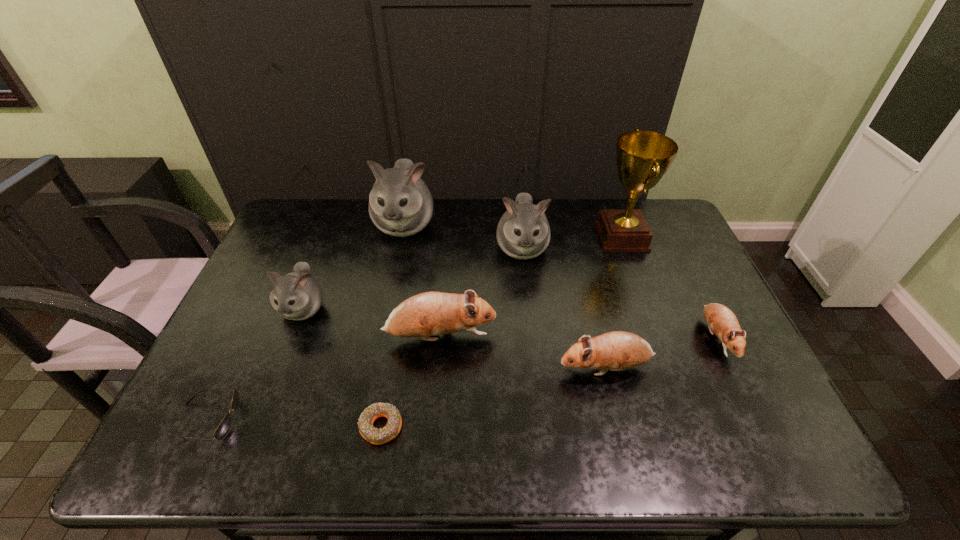
Where is `free spot between the second white hamster from right to left and the sunglasses`? This screenshot has height=540, width=960. free spot between the second white hamster from right to left and the sunglasses is located at coordinates coord(306,322).

Find the location of `free point between the chocolate doughnut and the biggest brown hamster`. free point between the chocolate doughnut and the biggest brown hamster is located at coordinates (411, 382).

Select which object is the eighth closest to the rightmost hamster. Please provide its 2D coordinates. Your answer should be formatted as a tuple, i.e. [(x, y)], where the tuple contains the x and y coordinates of a point satisfying the conditions above.

[(223, 429)]

Identify which object is the eighth closest to the biggest brown hamster. Please provide its 2D coordinates. Your answer should be formatted as a tuple, i.e. [(x, y)], where the tuple contains the x and y coordinates of a point satisfying the conditions above.

[(721, 320)]

Identify the location of hamster object that ranks as the fifth closest to the smallest brown hamster. (296, 296).

Identify the location of hamster that stands as the third closest to the second shortest hamster. (523, 232).

Find the location of a particular element. This screenshot has height=540, width=960. the second closest white hamster to the leftmost white hamster is located at coordinates (523, 232).

Identify which white hamster is the second nearest to the biggest white hamster. Please provide its 2D coordinates. Your answer should be formatted as a tuple, i.e. [(x, y)], where the tuple contains the x and y coordinates of a point satisfying the conditions above.

[(523, 232)]

You are a GUI agent. You are given a task and a screenshot of the screen. Output one action in this format:
    pyautogui.click(x=<x>, y=<y>)
    Task: Click on the brown hamster that is the second closest to the gold award
    
    Given the screenshot: What is the action you would take?
    pyautogui.click(x=618, y=350)

Identify the location of brown hamster that is the second closest one to the second brown hamster from right to left. (721, 320).